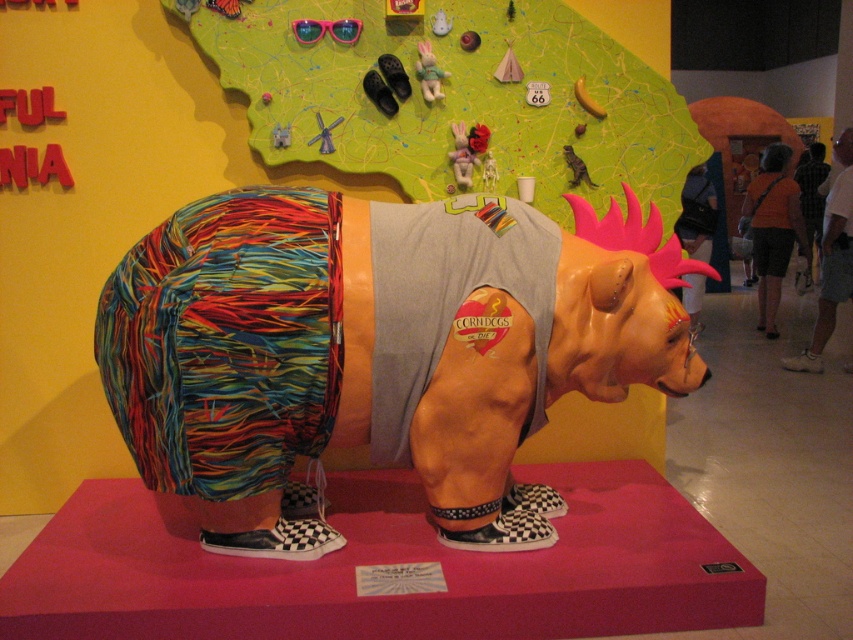
Between orange fabric shorts at right and checkered shirt at center, which one appears on the left side from the viewer's perspective?

From the viewer's perspective, orange fabric shorts at right appears more on the left side.

In order to click on orange fabric shorts at right in this screenshot , I will do `click(773, 228)`.

At what (x,y) coordinates should I click in order to perform the action: click on orange fabric shorts at right. Please return your answer as a coordinate pair (x, y). Looking at the image, I should click on (773, 228).

Can you confirm if textured fabric bear at center is shorter than checkered shirt at center?

In fact, textured fabric bear at center may be taller than checkered shirt at center.

Does point (115, 356) come farther from viewer compared to point (809, 266)?

No.

Where is `textured fabric bear at center`? The height and width of the screenshot is (640, 853). textured fabric bear at center is located at coordinates (376, 352).

Does gray shorts at center have a greater width compared to checkered shirt at center?

Yes.

What do you see at coordinates (831, 259) in the screenshot? The height and width of the screenshot is (640, 853). I see `gray shorts at center` at bounding box center [831, 259].

Where is `gray shorts at center`? gray shorts at center is located at coordinates (831, 259).